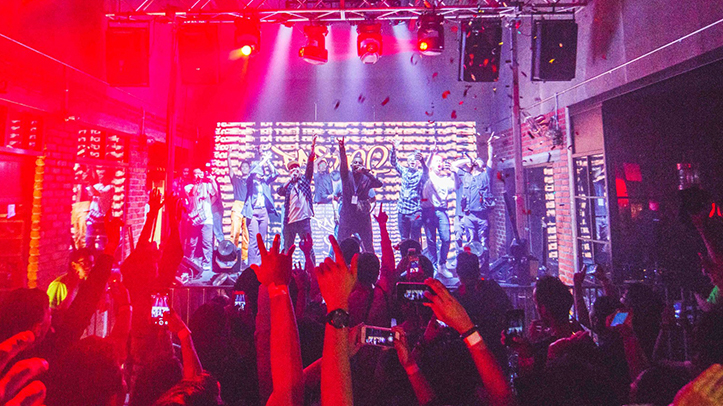
You are a GUI agent. You are given a task and a screenshot of the screen. Output one action in this format:
    pyautogui.click(x=<x>, y=<y>)
    Task: Click on the speakers
    This screenshot has height=406, width=723.
    Given the screenshot: What is the action you would take?
    pyautogui.click(x=478, y=36), pyautogui.click(x=565, y=50)